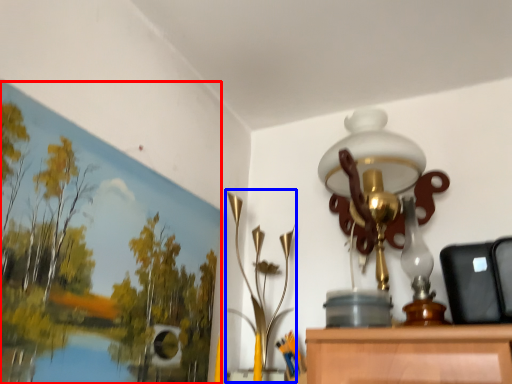
Question: Among these objects, which one is nearest to the camera, oil painting (highlighted by a red box) or lamp (highlighted by a blue box)?

Choices:
 (A) oil painting
 (B) lamp

Answer: (A)